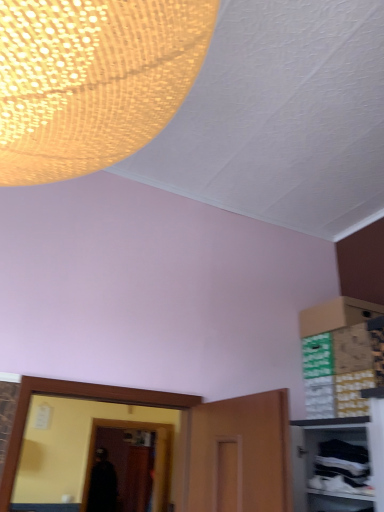
Describe the element at coordinates (156, 456) in the screenshot. The image size is (384, 512). I see `transparent glass door at center` at that location.

Where is `transparent glass door at center`? This screenshot has width=384, height=512. transparent glass door at center is located at coordinates (156, 456).

Measure the distance between white fabric cabinet at lower right and camera.

white fabric cabinet at lower right is 7.35 feet from camera.

Locate an element on the screen. Image resolution: width=384 pixels, height=512 pixels. white fabric cabinet at lower right is located at coordinates coord(314,462).

What do you see at coordinates (314, 462) in the screenshot? This screenshot has width=384, height=512. I see `white fabric cabinet at lower right` at bounding box center [314, 462].

Identify the location of transparent glass door at center. The image size is (384, 512). (156, 456).

Considering the positions of objects transparent glass door at center and white fabric cabinet at lower right in the image provided, who is more to the left, transparent glass door at center or white fabric cabinet at lower right?

Positioned to the left is transparent glass door at center.

Which object is closer to the camera, transparent glass door at center or white fabric cabinet at lower right?

white fabric cabinet at lower right is in front.

Considering the points (168, 434) and (299, 428), which point is behind, point (168, 434) or point (299, 428)?

The point (168, 434) is more distant.

From the image's perspective, is transparent glass door at center positioned above or below white fabric cabinet at lower right?

Based on their image positions, transparent glass door at center is located beneath white fabric cabinet at lower right.

From a real-world perspective, is transparent glass door at center above or below white fabric cabinet at lower right?

transparent glass door at center is below white fabric cabinet at lower right.

Between transparent glass door at center and white fabric cabinet at lower right, which one has larger width?

white fabric cabinet at lower right.

Can you confirm if transparent glass door at center is shorter than white fabric cabinet at lower right?

In fact, transparent glass door at center may be taller than white fabric cabinet at lower right.

In terms of size, does transparent glass door at center appear bigger or smaller than white fabric cabinet at lower right?

Clearly, transparent glass door at center is larger in size than white fabric cabinet at lower right.

Is transparent glass door at center inside or outside of white fabric cabinet at lower right?

The correct answer is: outside.

Is transparent glass door at center next to white fabric cabinet at lower right?

transparent glass door at center is not next to white fabric cabinet at lower right, and they're not touching.

Is transparent glass door at center looking in the opposite direction of white fabric cabinet at lower right?

No, transparent glass door at center's orientation is not away from white fabric cabinet at lower right.

Measure the distance from transparent glass door at center to white fabric cabinet at lower right.

The distance of transparent glass door at center from white fabric cabinet at lower right is 3.29 meters.

The image size is (384, 512). Identify the location of glass door below the white fabric cabinet at lower right (from the image's perspective). (156, 456).

Between white fabric cabinet at lower right and transparent glass door at center, which one appears on the right side from the viewer's perspective?

Positioned to the right is white fabric cabinet at lower right.

Which object is closer to the camera taking this photo, white fabric cabinet at lower right or transparent glass door at center?

white fabric cabinet at lower right is closer to the camera.

Between point (330, 506) and point (158, 474), which one is positioned in front?

The point (330, 506) is closer to the camera.

From the image's perspective, which one is positioned lower, white fabric cabinet at lower right or transparent glass door at center?

transparent glass door at center is shown below in the image.

From a real-world perspective, is white fabric cabinet at lower right above or below transparent glass door at center?

Clearly, from a real-world perspective, white fabric cabinet at lower right is above transparent glass door at center.

Is white fabric cabinet at lower right thinner than transparent glass door at center?

No, white fabric cabinet at lower right is not thinner than transparent glass door at center.

Which of these two, white fabric cabinet at lower right or transparent glass door at center, stands shorter?

white fabric cabinet at lower right.

Looking at the image, does white fabric cabinet at lower right seem bigger or smaller compared to transparent glass door at center?

white fabric cabinet at lower right is smaller than transparent glass door at center.

Is white fabric cabinet at lower right inside or outside of transparent glass door at center?

white fabric cabinet at lower right lies outside transparent glass door at center.

Is there a large distance between white fabric cabinet at lower right and transparent glass door at center?

Yes.

Does white fabric cabinet at lower right turn towards transparent glass door at center?

No, white fabric cabinet at lower right does not turn towards transparent glass door at center.

Where is `cabinetry that is above the transparent glass door at center (from a real-world perspective)`? Image resolution: width=384 pixels, height=512 pixels. cabinetry that is above the transparent glass door at center (from a real-world perspective) is located at coordinates (314, 462).

Where is `glass door located on the left of white fabric cabinet at lower right`? glass door located on the left of white fabric cabinet at lower right is located at coordinates (156, 456).

This screenshot has width=384, height=512. Identify the location of glass door behind the white fabric cabinet at lower right. (156, 456).